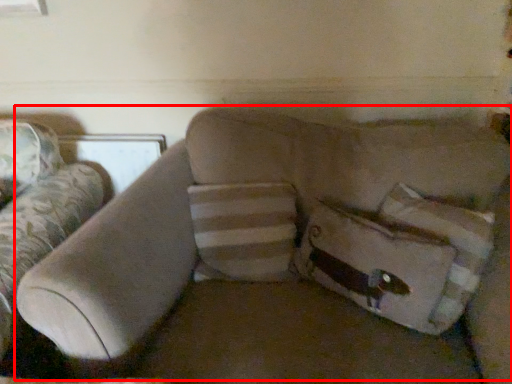
Question: Observing the image, what is the correct spatial positioning of couch (annotated by the red box) in reference to pillow?

Choices:
 (A) left
 (B) right

Answer: (A)